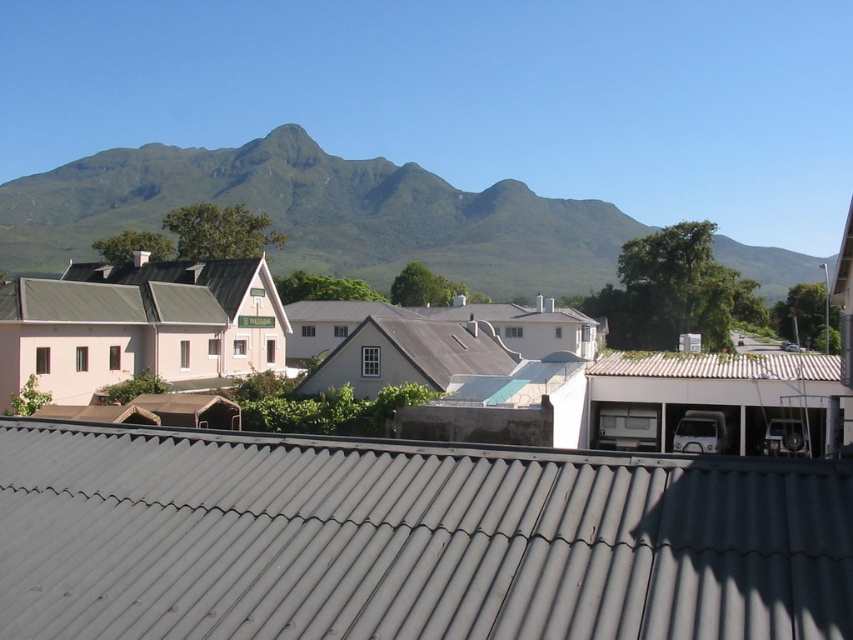
Question: Which point is closer to the camera taking this photo?

Choices:
 (A) (757, 376)
 (B) (310, 595)
 (C) (287, 240)

Answer: (B)

Question: Is green grassy mountain at upper center below metallic corrugated roof at center?

Choices:
 (A) yes
 (B) no

Answer: (B)

Question: Among these objects, which one is farthest from the camera?

Choices:
 (A) green grassy mountain at upper center
 (B) metallic corrugated roof at center
 (C) gray corrugated metal roof at center

Answer: (A)

Question: Is gray corrugated metal roof at center thinner than metallic corrugated roof at center?

Choices:
 (A) yes
 (B) no

Answer: (A)

Question: Which point is farther to the camera?

Choices:
 (A) gray corrugated metal roof at center
 (B) green grassy mountain at upper center
 (C) metallic corrugated roof at center

Answer: (B)

Question: Is green grassy mountain at upper center positioned at the back of metallic corrugated roof at center?

Choices:
 (A) no
 (B) yes

Answer: (B)